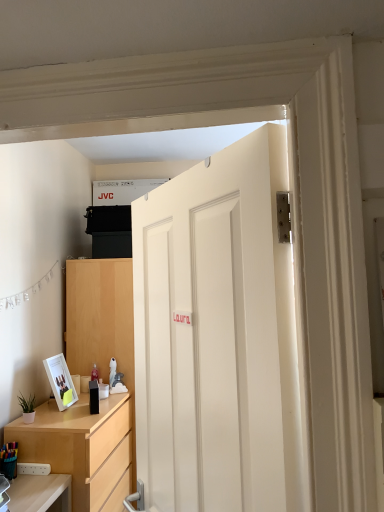
I want to click on vacant space that is in between green matte plant at lower left and white glossy picture frame at lower left, so click(43, 415).